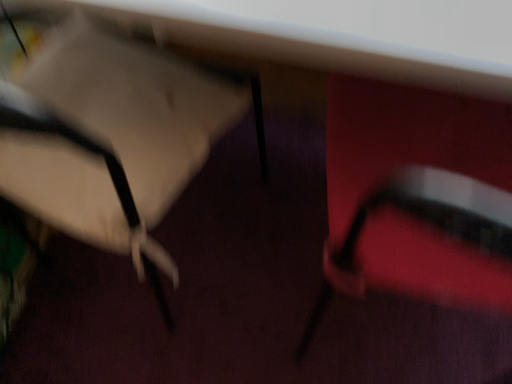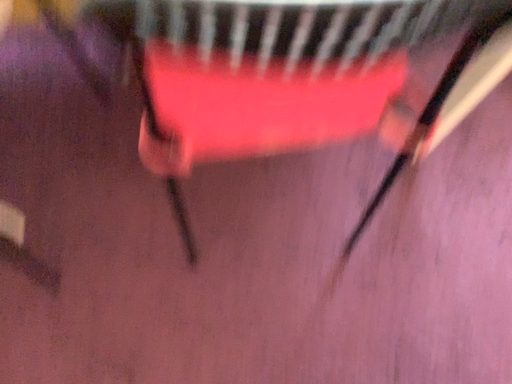
Question: How did the camera likely rotate when shooting the video?

Choices:
 (A) rotated right
 (B) rotated left

Answer: (A)